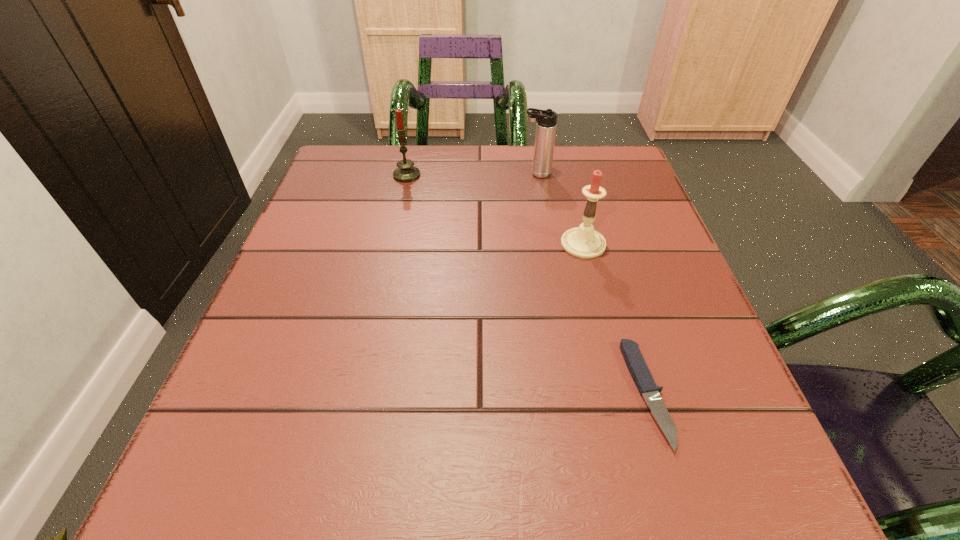
I want to click on free space that satisfies the following two spatial constraints: 1. on the front side of the third farthest object; 2. on the left side of the nearest object, so click(621, 393).

Identify the location of free location that satisfies the following two spatial constraints: 1. on the front side of the left candle; 2. on the left side of the steak knife. (360, 393).

The height and width of the screenshot is (540, 960). I want to click on free space in the image that satisfies the following two spatial constraints: 1. on the handle side of the thermos bottle; 2. on the left side of the right candle, so click(x=548, y=244).

You are a GUI agent. You are given a task and a screenshot of the screen. Output one action in this format:
    pyautogui.click(x=<x>, y=<y>)
    Task: Click on the vacant space that satisfies the following two spatial constraints: 1. on the back side of the nearer candle; 2. on the handle side of the thermos bottle
    This screenshot has width=960, height=540.
    Given the screenshot: What is the action you would take?
    pyautogui.click(x=565, y=174)

Locate an element on the screen. Image resolution: width=960 pixels, height=540 pixels. vacant space that satisfies the following two spatial constraints: 1. on the front side of the shortest object; 2. on the left side of the leftmost object is located at coordinates (360, 393).